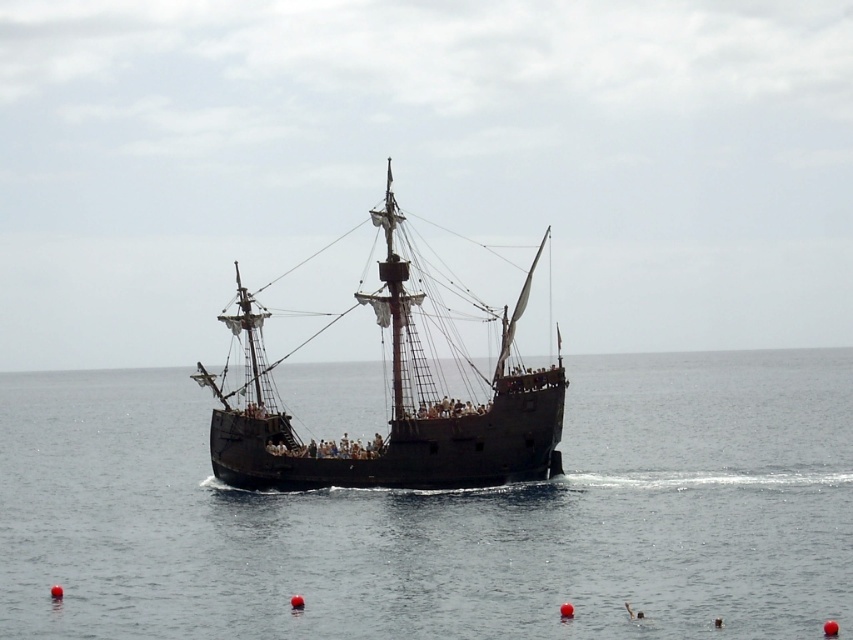
You are a sailor on the black wooden pirate ship at center. You notice the black water at center nearby. In which direction relative to the ship is the black water located?

The black water at center is positioned on the right side of the black wooden pirate ship at center, so it is located to the right of the ship.

You are standing on the deck of the black wooden pirate ship at center. Looking down, you see the black water at center. Which object is closer to you?

The black wooden pirate ship at center is closer to you since you are standing on it, while the black water at center is located below it.

You are a sailor on a small boat that is 10 feet wide. You want to pass between the black water at center and the black wooden pirate ship at center. Can your boat fit through the gap between them?

The gap between the black water at center and the black wooden pirate ship at center is 51.07 feet. Since your boat is only 10 feet wide, it can easily pass through the gap between them.